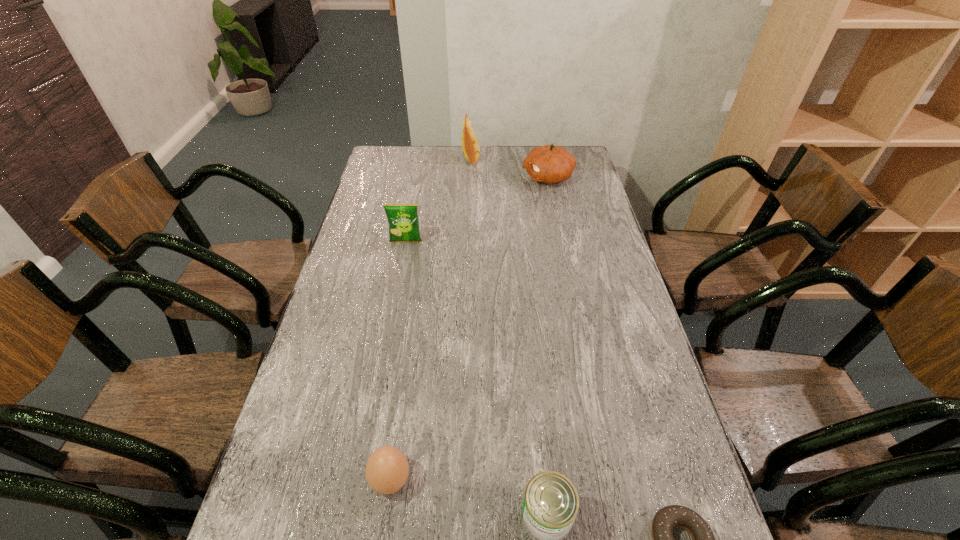
This screenshot has height=540, width=960. I want to click on vacant space at the far left corner of the desktop, so click(x=390, y=146).

You are a GUI agent. You are given a task and a screenshot of the screen. Output one action in this format:
    pyautogui.click(x=<x>, y=<y>)
    Task: Click on the free spot between the pumpkin and the fourth nearest object
    This screenshot has width=960, height=540.
    Given the screenshot: What is the action you would take?
    pyautogui.click(x=477, y=210)

Point out which object is positioned as the nearest to the nearer crisp (potato chip). Please provide its 2D coordinates. Your answer should be formatted as a tuple, i.e. [(x, y)], where the tuple contains the x and y coordinates of a point satisfying the conditions above.

[(550, 164)]

Where is `the fourth closest object to the boiled egg`? the fourth closest object to the boiled egg is located at coordinates (550, 164).

Locate an element on the screen. The image size is (960, 540). free space that satisfies the following two spatial constraints: 1. on the front face of the pumpkin; 2. on the front-facing side of the nearer crisp (potato chip) is located at coordinates (562, 242).

At what (x,y) coordinates should I click in order to perform the action: click on vacant point that satisfies the following two spatial constraints: 1. on the front-facing side of the right crisp (potato chip); 2. on the front-facing side of the fourth nearest object. Please return your answer as a coordinate pair (x, y). Image resolution: width=960 pixels, height=540 pixels. Looking at the image, I should click on (468, 242).